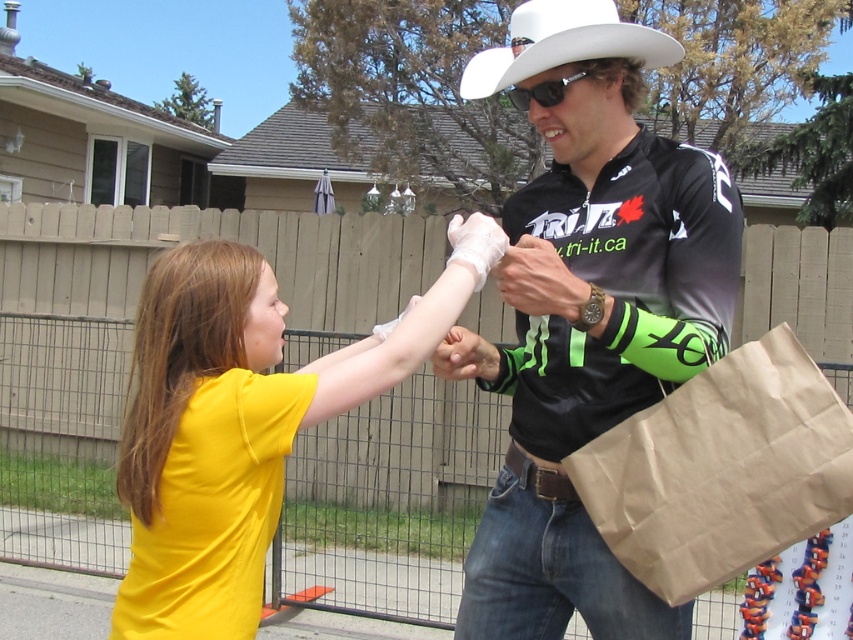
Question: Can you confirm if yellow matte shirt at center is positioned above brown paper bag at right?

Choices:
 (A) yes
 (B) no

Answer: (A)

Question: Considering the real-world distances, which object is farthest from the white felt cowboy hat at upper center?

Choices:
 (A) yellow matte shirt at center
 (B) brown paper bag at right

Answer: (B)

Question: Estimate the real-world distances between objects in this image. Which object is farther from the white felt cowboy hat at upper center?

Choices:
 (A) yellow matte shirt at center
 (B) black jersey at center

Answer: (A)

Question: Which of the following is the closest to the observer?

Choices:
 (A) brown paper bag at right
 (B) white felt cowboy hat at upper center

Answer: (A)

Question: Can you confirm if black jersey at center is positioned below brown paper bag at right?

Choices:
 (A) no
 (B) yes

Answer: (A)

Question: Can you confirm if yellow matte shirt at center is thinner than brown paper bag at right?

Choices:
 (A) yes
 (B) no

Answer: (B)